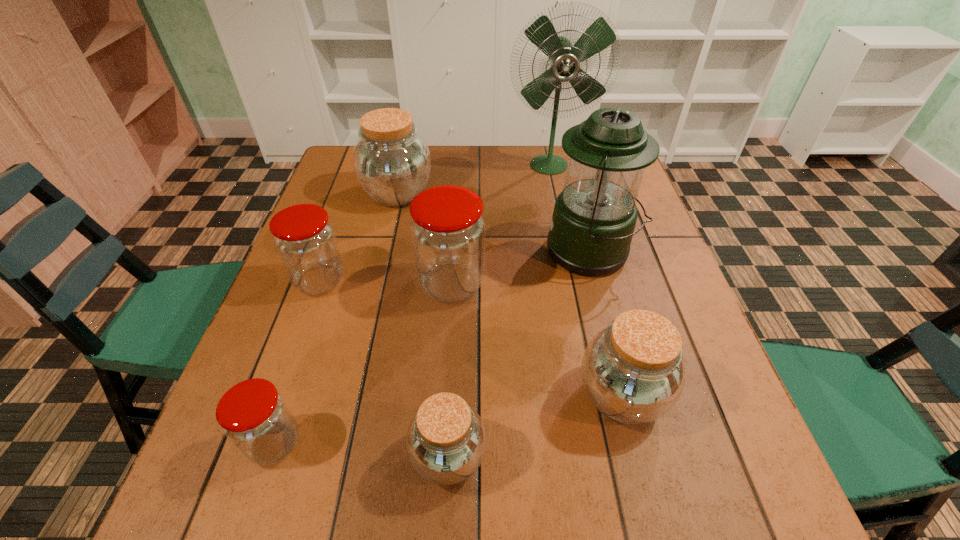
This screenshot has width=960, height=540. I want to click on fan that is at the far edge, so click(x=564, y=58).

What are the coordinates of `jar that is at the far edge` in the screenshot? It's located at (392, 162).

This screenshot has height=540, width=960. I want to click on object that is at the near edge, so click(446, 440).

What are the coordinates of `fan situated at the right edge` in the screenshot? It's located at (564, 58).

I want to click on lantern that is at the right edge, so click(x=594, y=217).

You are a GUI agent. You are given a task and a screenshot of the screen. Output one action in this format:
    pyautogui.click(x=<x>, y=<y>)
    Task: Click on the jar at the right edge
    The width and height of the screenshot is (960, 540).
    Given the screenshot: What is the action you would take?
    pyautogui.click(x=632, y=371)

Identify the location of object that is at the far left corner. The width and height of the screenshot is (960, 540). (392, 162).

This screenshot has width=960, height=540. What are the coordinates of `object that is at the far right corner` in the screenshot? It's located at (564, 58).

Where is `free space at the far edge of the desktop`? This screenshot has height=540, width=960. free space at the far edge of the desktop is located at coordinates (499, 184).

I want to click on vacant space at the left edge of the desktop, so click(x=339, y=292).